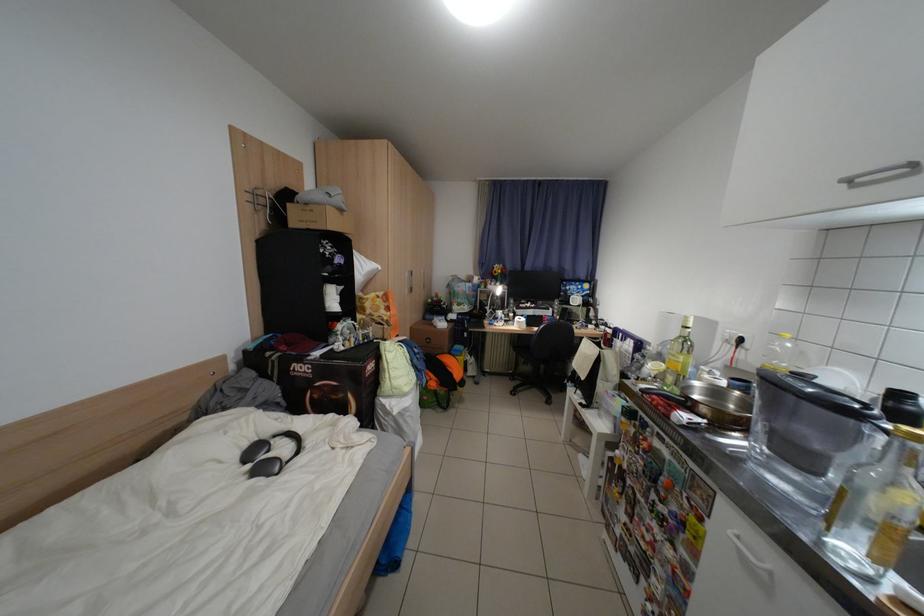
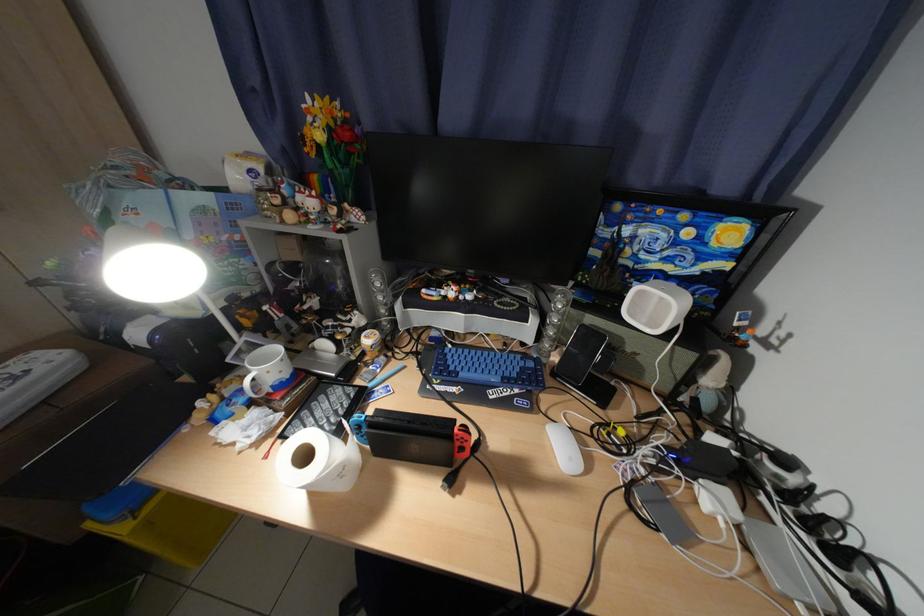
What movement of the cameraman would produce the second image?

The cameraman walked toward right, forward.